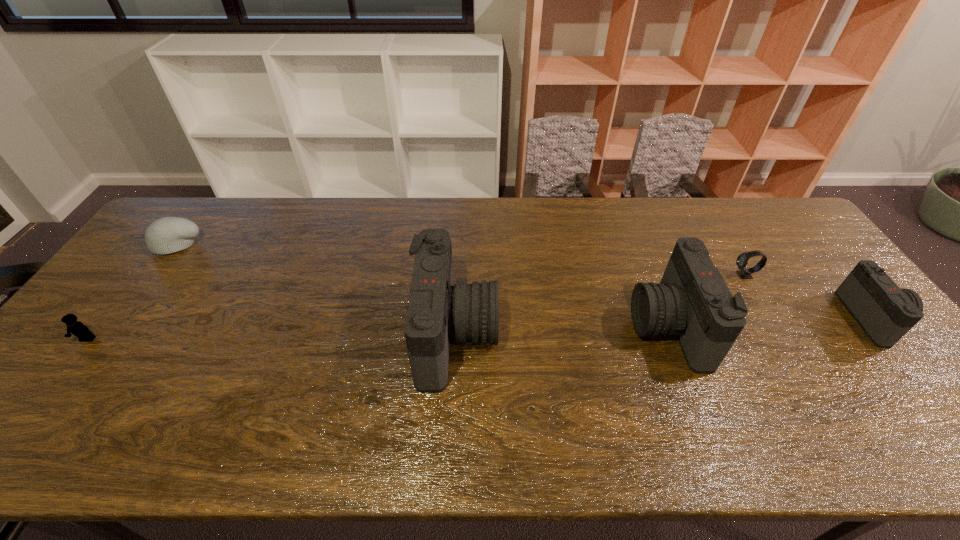
At what (x,y) coordinates should I click in order to perform the action: click on vacant place for an extra camera on the left. Please return your answer as a coordinate pair (x, y). Image resolution: width=960 pixels, height=540 pixels. Looking at the image, I should click on (236, 342).